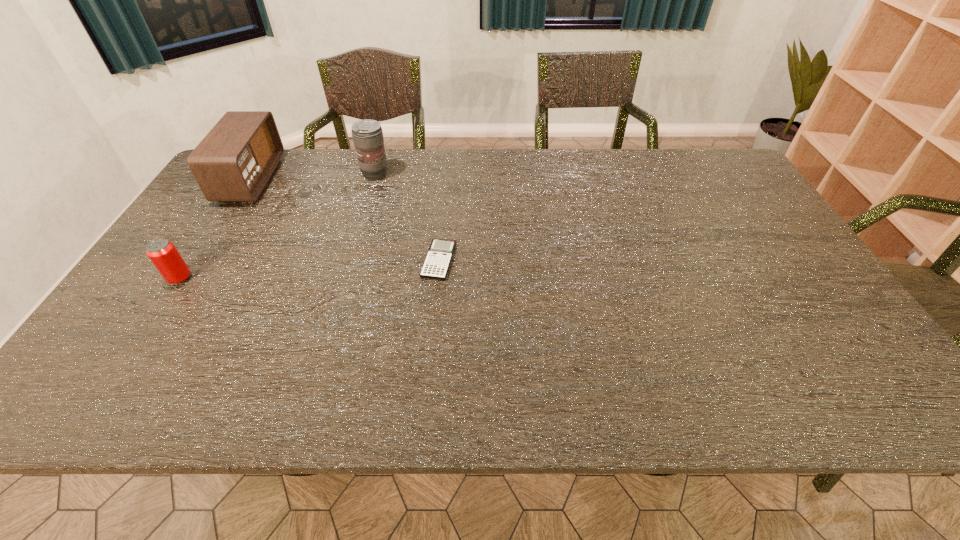
Locate an element on the screen. This screenshot has height=540, width=960. unoccupied area between the radio receiver and the rightmost object is located at coordinates (346, 220).

I want to click on object that is the closest to the can, so click(234, 161).

Choose which object is the nearest neighbor to the third object from left to right. Please provide its 2D coordinates. Your answer should be formatted as a tuple, i.e. [(x, y)], where the tuple contains the x and y coordinates of a point satisfying the conditions above.

[(234, 161)]

Identify the location of vacant space that satisfies the following two spatial constraints: 1. on the side of the rightmost object where the control switches are located; 2. on the left side of the third object from left to right. The height and width of the screenshot is (540, 960). (349, 261).

Identify the location of free space that satisfies the following two spatial constraints: 1. on the side of the rightmost object where the control switches are located; 2. on the left side of the second object from right to left. (349, 261).

At what (x,y) coordinates should I click in order to perform the action: click on blank area in the image that satisfies the following two spatial constraints: 1. on the side of the telephoto lens where the control switches are located; 2. on the left side of the calculator. Please return your answer as a coordinate pair (x, y). Image resolution: width=960 pixels, height=540 pixels. Looking at the image, I should click on (349, 261).

Identify the location of free space that satisfies the following two spatial constraints: 1. on the front-facing side of the calculator; 2. on the left side of the radio receiver. This screenshot has width=960, height=540. (200, 261).

The height and width of the screenshot is (540, 960). In order to click on free space that satisfies the following two spatial constraints: 1. on the back side of the shortest object; 2. on the front-facing side of the radio receiver in this screenshot , I will do `click(446, 179)`.

Find the location of a particular element. Image resolution: width=960 pixels, height=540 pixels. vacant space that satisfies the following two spatial constraints: 1. on the side of the telephoto lens where the control switches are located; 2. on the front side of the can is located at coordinates (345, 278).